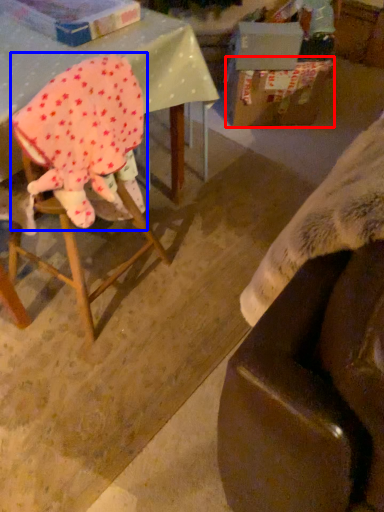
Question: Which of the following is the farthest to the observer, cardboard box (highlighted by a red box) or woman (highlighted by a blue box)?

Choices:
 (A) cardboard box
 (B) woman

Answer: (A)